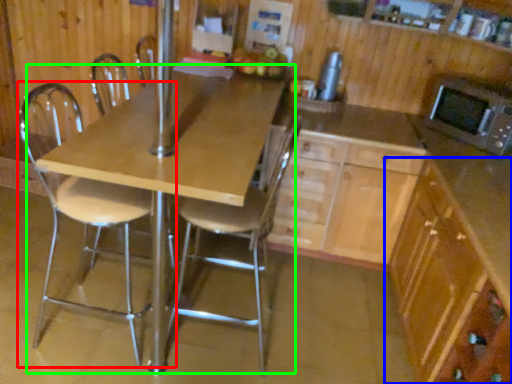
Question: Estimate the real-world distances between objects in this image. Which object is farther from chair (highlighted by a red box), cabinetry (highlighted by a blue box) or table (highlighted by a green box)?

Choices:
 (A) cabinetry
 (B) table

Answer: (A)